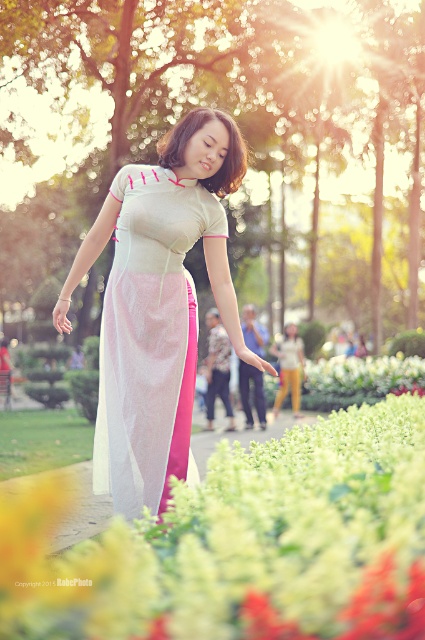
Does translucent silk skirt at center have a greater width compared to white sheer dress at center?

Yes.

Does translucent silk skirt at center have a lesser height compared to white sheer dress at center?

Correct, translucent silk skirt at center is not as tall as white sheer dress at center.

Find the location of a particular element. The width and height of the screenshot is (425, 640). translucent silk skirt at center is located at coordinates point(243,545).